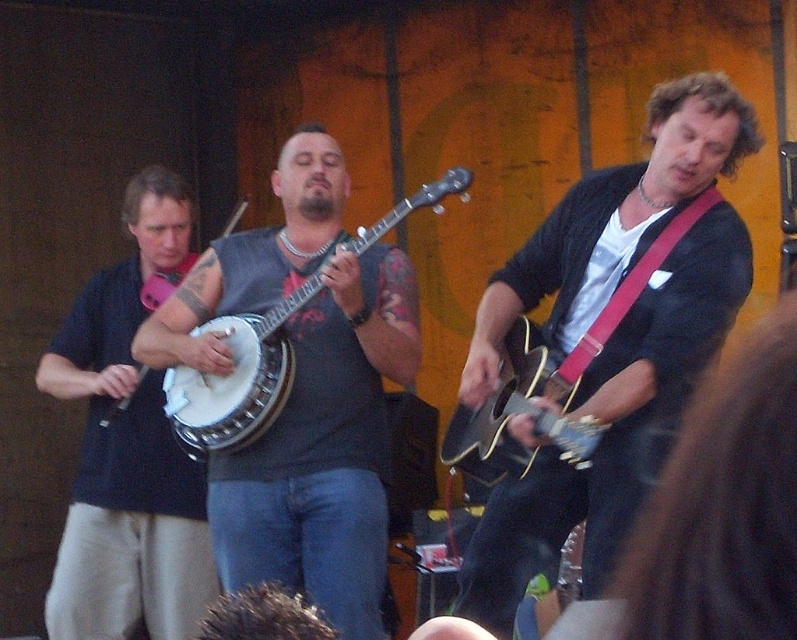
Is matte black banjo at left above white wood banjo at center?

No, matte black banjo at left is not above white wood banjo at center.

Looking at this image, can you confirm if matte black banjo at left is positioned below white wood banjo at center?

Yes.

Is point (50, 369) less distant than point (281, 371)?

No, (50, 369) is behind (281, 371).

What are the coordinates of `matte black banjo at left` in the screenshot? It's located at (128, 445).

Does matte black banjo at center have a larger size compared to matte wood banjo at center?

Yes.

Who is more distant from viewer, (368, 518) or (491, 454)?

The point (368, 518) is behind.

Is point (313, 426) positioned after point (572, 387)?

That is True.

Locate an element on the screen. matte black banjo at center is located at coordinates (324, 449).

Can you confirm if matte black banjo at center is wider than matte black banjo at left?

Correct, the width of matte black banjo at center exceeds that of matte black banjo at left.

Which is above, matte black banjo at center or matte black banjo at left?

matte black banjo at center is higher up.

The width and height of the screenshot is (797, 640). What do you see at coordinates (324, 449) in the screenshot?
I see `matte black banjo at center` at bounding box center [324, 449].

You are a GUI agent. You are given a task and a screenshot of the screen. Output one action in this format:
    pyautogui.click(x=<x>, y=<y>)
    Task: Click on the matte black banjo at center
    The width and height of the screenshot is (797, 640).
    Given the screenshot: What is the action you would take?
    pyautogui.click(x=324, y=449)